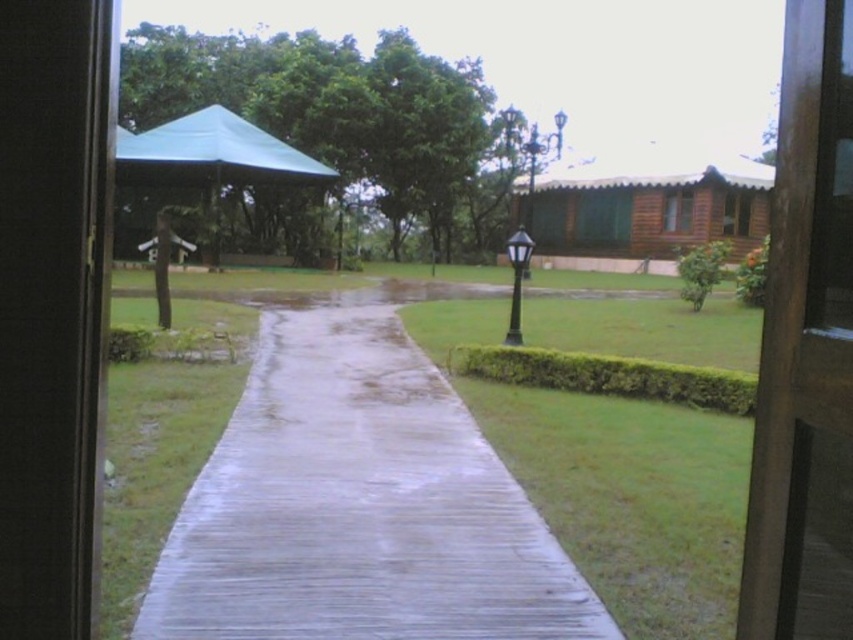
Question: Which point is closer to the camera?

Choices:
 (A) brown wooden hut at center
 (B) green fabric canopy at upper left
 (C) white concrete pavement at center

Answer: (C)

Question: Is white concrete pavement at center below brown wooden hut at center?

Choices:
 (A) no
 (B) yes

Answer: (B)

Question: Which point is closer to the camera taking this photo?

Choices:
 (A) (167, 138)
 (B) (566, 445)

Answer: (B)

Question: Is white concrete pavement at center closer to the viewer compared to brown wooden hut at center?

Choices:
 (A) yes
 (B) no

Answer: (A)

Question: Estimate the real-world distances between objects in this image. Which object is closer to the brown wooden hut at center?

Choices:
 (A) green fabric canopy at upper left
 (B) green grass at center
 (C) white concrete pavement at center

Answer: (A)

Question: Does green grass at center have a smaller size compared to green fabric canopy at upper left?

Choices:
 (A) no
 (B) yes

Answer: (B)